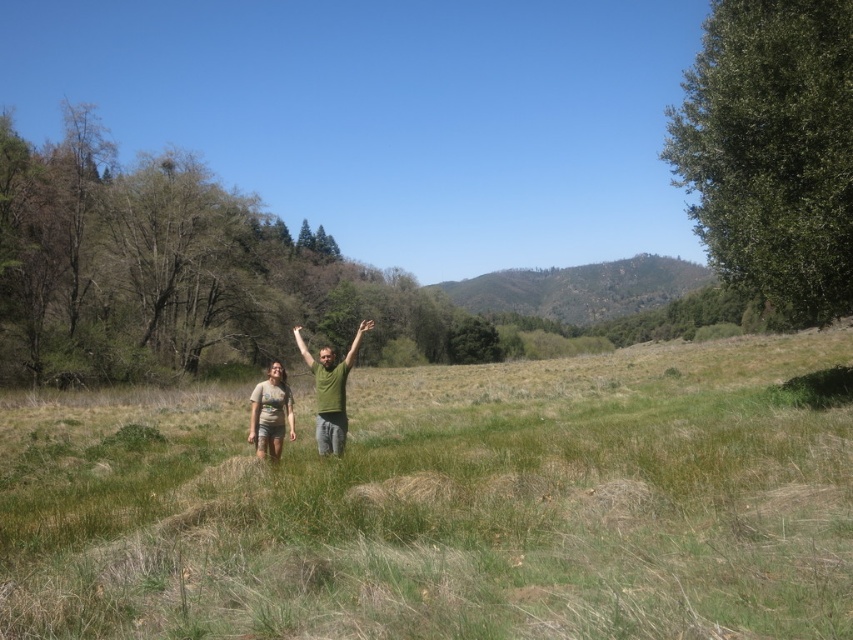
You are planning to take a photo of the green matte shirt at center and the green textured hillside at center from a distance. If you want to ensure both are in focus, what should you consider about their distance apart?

The green textured hillside at center is 515.86 feet away from the green matte shirt at center. To ensure both are in focus, you need to use a small aperture setting or focus at the hyperfocal distance to maximize depth of field, as the distance between them is significant.

You are planning to take a photo of the green textured hillside at center and the green matte shirt at center. Which object should you focus on first if you want to capture both in a single shot without moving the camera?

The green textured hillside at center is larger in size than the green matte shirt at center, so you should focus on the green textured hillside at center first to ensure it fits within the frame before adjusting for the smaller green matte shirt at center.

You are standing at the point marked as point (770, 150). What object is located exactly at this point?

The point (770, 150) is where the green leafy tree at right is located.